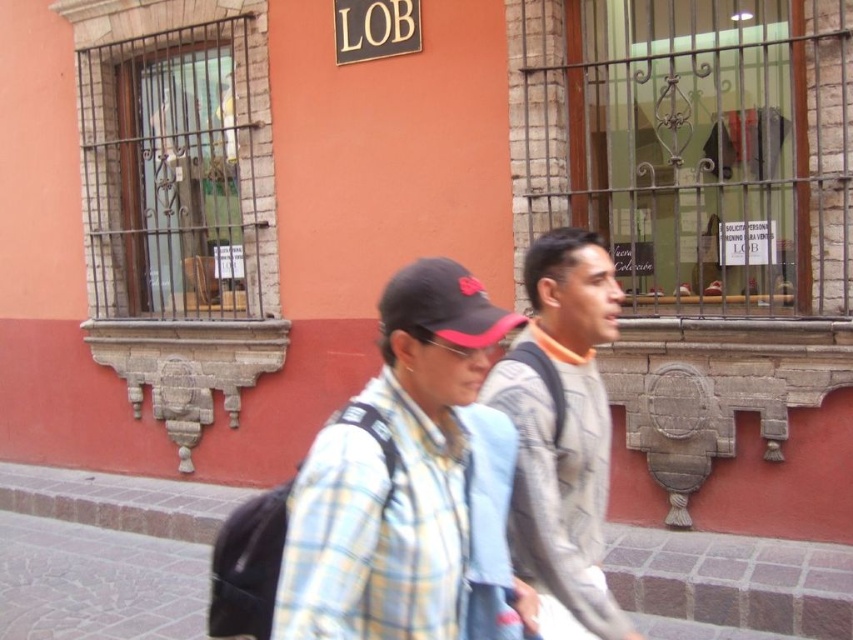
Question: Is plaid fabric shirt at center to the left of gray textured sweater at center from the viewer's perspective?

Choices:
 (A) yes
 (B) no

Answer: (A)

Question: Which of the following is the closest to the observer?

Choices:
 (A) plaid fabric shirt at center
 (B) brick pavement at center
 (C) gray textured sweater at center

Answer: (C)

Question: Does plaid fabric shirt at center appear on the left side of gray textured sweater at center?

Choices:
 (A) yes
 (B) no

Answer: (A)

Question: Which point is farther to the camera?

Choices:
 (A) (96, 540)
 (B) (543, 609)
 (C) (549, 328)

Answer: (A)

Question: Estimate the real-world distances between objects in this image. Which object is farther from the brick pavement at center?

Choices:
 (A) gray textured sweater at center
 (B) plaid fabric shirt at center

Answer: (A)

Question: Is plaid fabric shirt at center smaller than brick pavement at center?

Choices:
 (A) yes
 (B) no

Answer: (B)